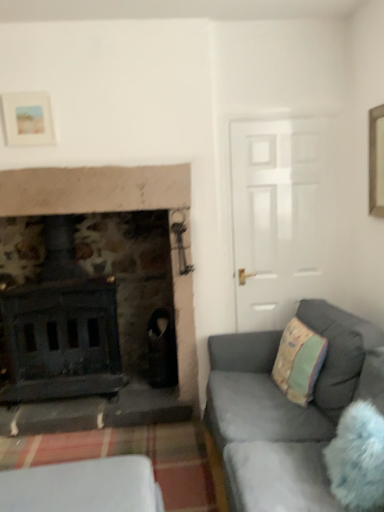
Question: Is matte white picture frame at upper left taller than white plastic container at lower left?

Choices:
 (A) yes
 (B) no

Answer: (B)

Question: Does matte white picture frame at upper left appear on the right side of white plastic container at lower left?

Choices:
 (A) yes
 (B) no

Answer: (B)

Question: Considering the relative sizes of matte white picture frame at upper left and white plastic container at lower left in the image provided, is matte white picture frame at upper left shorter than white plastic container at lower left?

Choices:
 (A) yes
 (B) no

Answer: (A)

Question: From a real-world perspective, is matte white picture frame at upper left physically below white plastic container at lower left?

Choices:
 (A) no
 (B) yes

Answer: (A)

Question: Does matte white picture frame at upper left lie behind white plastic container at lower left?

Choices:
 (A) yes
 (B) no

Answer: (A)

Question: Is matte white picture frame at upper left in contact with white plastic container at lower left?

Choices:
 (A) no
 (B) yes

Answer: (A)

Question: Is white plastic container at lower left to the left of pastel green fabric pillow at right from the viewer's perspective?

Choices:
 (A) yes
 (B) no

Answer: (A)

Question: Can you confirm if white plastic container at lower left is thinner than pastel green fabric pillow at right?

Choices:
 (A) yes
 (B) no

Answer: (B)

Question: Is white plastic container at lower left bigger than pastel green fabric pillow at right?

Choices:
 (A) no
 (B) yes

Answer: (B)

Question: Are white plastic container at lower left and pastel green fabric pillow at right far apart?

Choices:
 (A) no
 (B) yes

Answer: (B)

Question: From the image's perspective, would you say white plastic container at lower left is shown under pastel green fabric pillow at right?

Choices:
 (A) yes
 (B) no

Answer: (A)

Question: Can we say white plastic container at lower left lies outside pastel green fabric pillow at right?

Choices:
 (A) no
 (B) yes

Answer: (B)

Question: From a real-world perspective, is white plastic container at lower left below velvet grey couch at lower right?

Choices:
 (A) yes
 (B) no

Answer: (A)